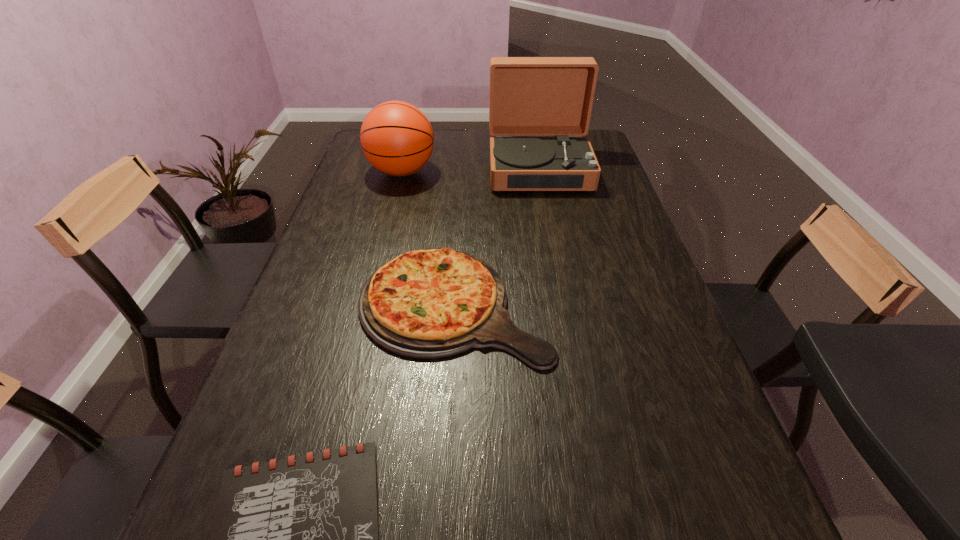
Locate an element on the screen. This screenshot has width=960, height=540. phonograph record is located at coordinates (529, 96).

This screenshot has width=960, height=540. Find the location of `the second tallest object`. the second tallest object is located at coordinates (396, 137).

Identify the location of the second shortest object. The height and width of the screenshot is (540, 960). (433, 303).

At what (x,y) coordinates should I click in order to perform the action: click on the third farthest object. Please return your answer as a coordinate pair (x, y). Image resolution: width=960 pixels, height=540 pixels. Looking at the image, I should click on (433, 303).

The image size is (960, 540). Identify the location of vacant region located 0.050m on the face of the phonograph record. coord(545,203).

This screenshot has height=540, width=960. Identify the location of vacant space located 0.230m on the front of the basketball. (386, 233).

Where is `vacant space located 0.070m on the front of the third farthest object`? Image resolution: width=960 pixels, height=540 pixels. vacant space located 0.070m on the front of the third farthest object is located at coordinates (449, 401).

Where is `phonograph record that is at the far edge`? The width and height of the screenshot is (960, 540). phonograph record that is at the far edge is located at coordinates (529, 96).

Locate an element on the screen. This screenshot has width=960, height=540. basketball located in the far edge section of the desktop is located at coordinates (396, 137).

The image size is (960, 540). I want to click on basketball located at the left edge, so click(x=396, y=137).